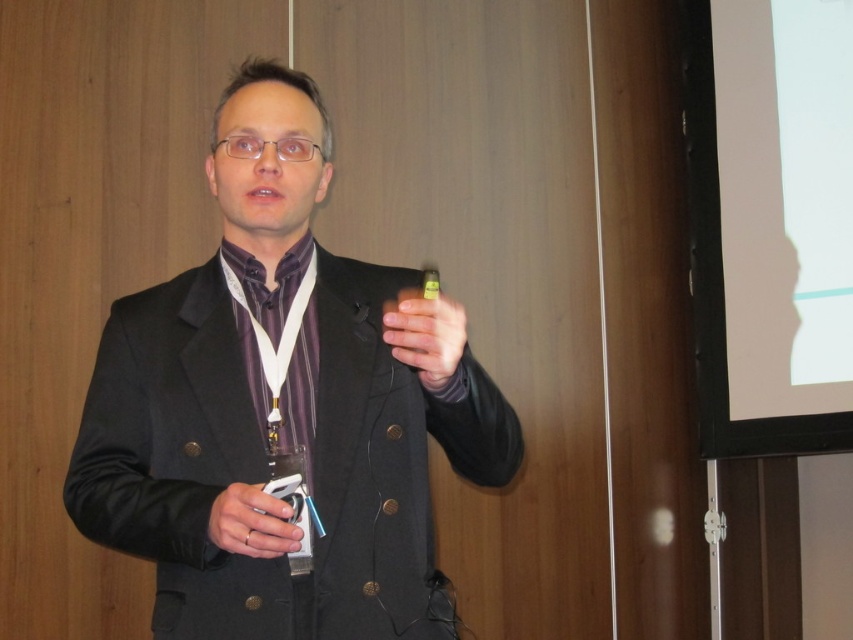
Question: Which object is farther from the camera taking this photo?

Choices:
 (A) matte black pen at center
 (B) matte black remote at lower left
 (C) black matte suit at center

Answer: (C)

Question: Is black matte suit at center below matte black remote at lower left?

Choices:
 (A) no
 (B) yes

Answer: (A)

Question: Based on their relative distances, which object is nearer to the black matte suit at center?

Choices:
 (A) matte black pen at center
 (B) matte black remote at lower left

Answer: (A)

Question: Does black matte suit at center have a greater width compared to matte black remote at lower left?

Choices:
 (A) no
 (B) yes

Answer: (B)

Question: Among these points, which one is nearest to the camera?

Choices:
 (A) (225, 500)
 (B) (293, 163)

Answer: (A)

Question: Does black matte suit at center appear on the left side of matte black pen at center?

Choices:
 (A) no
 (B) yes

Answer: (B)